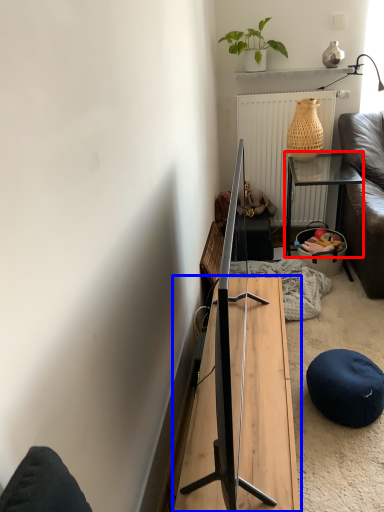
Question: Among these objects, which one is nearest to the camera, table (highlighted by a red box) or table (highlighted by a blue box)?

Choices:
 (A) table
 (B) table

Answer: (B)